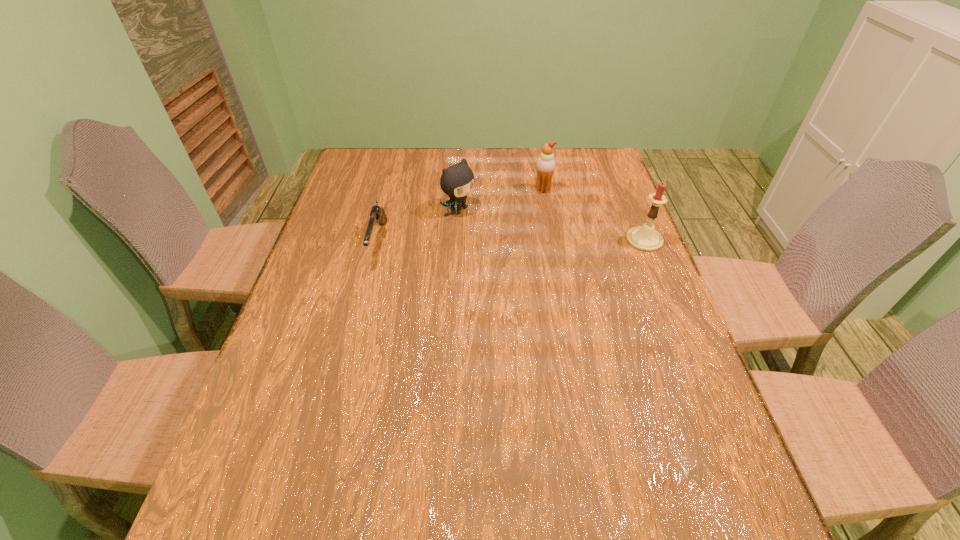
Identify the location of blank area located 0.140m on the front-facing side of the third object from right to left. This screenshot has width=960, height=540. (509, 240).

Find the location of `vacant space located at the front with a straw on the icecream`. vacant space located at the front with a straw on the icecream is located at coordinates (520, 206).

Locate an element on the screen. The width and height of the screenshot is (960, 540). free spot located at the front with a straw on the icecream is located at coordinates (493, 225).

You are a GUI agent. You are given a task and a screenshot of the screen. Output one action in this format:
    pyautogui.click(x=<x>, y=<y>)
    Task: Click on the vacant area located at the front with a straw on the icecream
    
    Given the screenshot: What is the action you would take?
    (x=518, y=207)

Where is `object present at the left edge`? object present at the left edge is located at coordinates (377, 215).

Find the location of a particular element. The image size is (960, 540). object situated at the right edge is located at coordinates (646, 238).

What are the coordinates of `vacant space at the far edge` in the screenshot? It's located at (493, 150).

Image resolution: width=960 pixels, height=540 pixels. In the image, there is a desktop. Find the location of `free space at the near edge`. free space at the near edge is located at coordinates (528, 437).

Where is `vacant space at the left edge of the desktop`? The image size is (960, 540). vacant space at the left edge of the desktop is located at coordinates (266, 391).

Locate an element on the screen. Image resolution: width=960 pixels, height=540 pixels. vacant space at the right edge of the desktop is located at coordinates (596, 185).